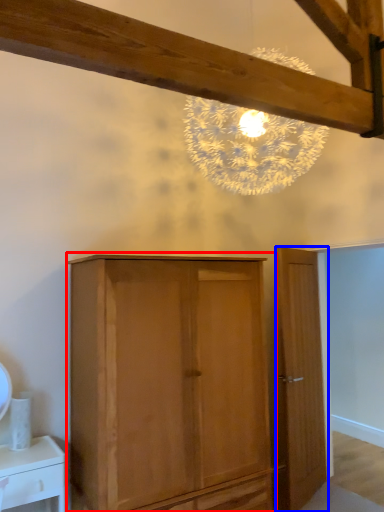
Question: Which point is further to the camera, cupboard (highlighted by a red box) or door (highlighted by a blue box)?

Choices:
 (A) cupboard
 (B) door

Answer: (B)